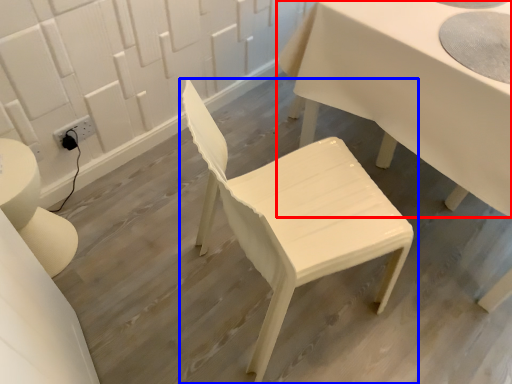
Question: Which object is closer to the camera taking this photo, table (highlighted by a red box) or chair (highlighted by a blue box)?

Choices:
 (A) table
 (B) chair

Answer: (B)